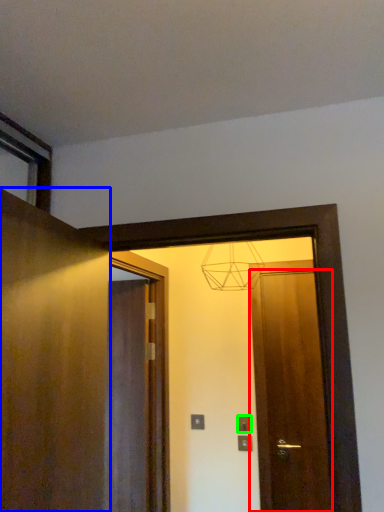
Question: Estimate the real-world distances between objects in this image. Which object is farther from door (highlighted by a red box), door (highlighted by a blue box) or electric outlet (highlighted by a green box)?

Choices:
 (A) door
 (B) electric outlet

Answer: (A)